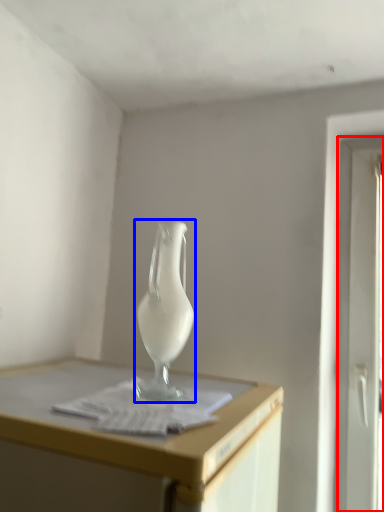
Question: Which object appears farthest to the camera in this image, screen door (highlighted by a red box) or vase (highlighted by a blue box)?

Choices:
 (A) screen door
 (B) vase

Answer: (A)